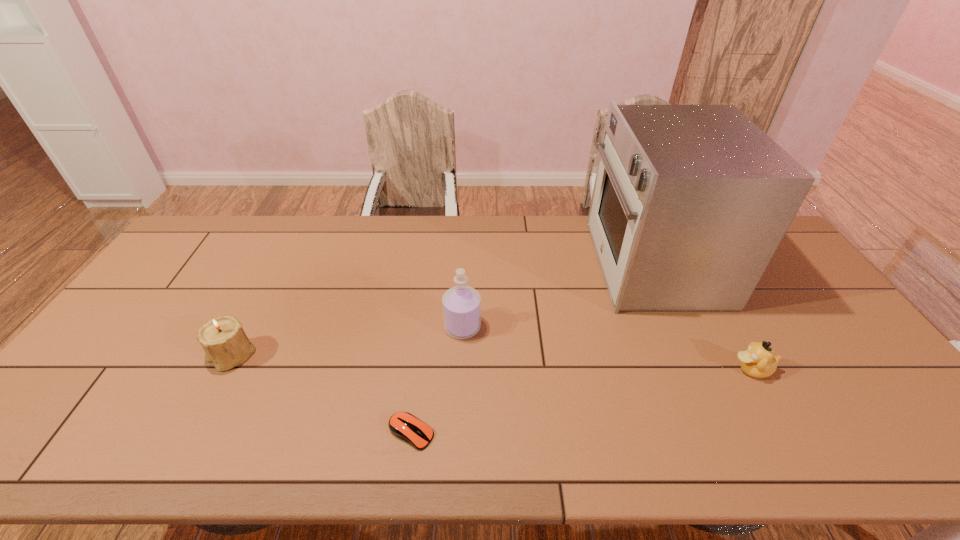
The height and width of the screenshot is (540, 960). Find the location of `toaster oven`. toaster oven is located at coordinates (690, 202).

You are a GUI agent. You are given a task and a screenshot of the screen. Output one action in this format:
    pyautogui.click(x=<x>, y=<y>)
    Task: Click on the fourth shortest object
    
    Given the screenshot: What is the action you would take?
    pyautogui.click(x=461, y=304)

At what (x,y) coordinates should I click in order to perform the action: click on the third object from left to right. Please return your answer as a coordinate pair (x, y). Looking at the image, I should click on (461, 304).

In order to click on the leftmost object in this screenshot , I will do `click(226, 345)`.

I want to click on candle_holder, so click(x=226, y=345).

This screenshot has width=960, height=540. In order to click on duckling in this screenshot , I will do `click(758, 361)`.

The image size is (960, 540). I want to click on the shortest object, so click(x=404, y=425).

I want to click on the fourth object from right to left, so click(x=404, y=425).

Where is `free point located 0.240m on the front panel of the toaster oven`? Image resolution: width=960 pixels, height=540 pixels. free point located 0.240m on the front panel of the toaster oven is located at coordinates (518, 264).

You are a GUI agent. You are given a task and a screenshot of the screen. Output one action in this format:
    pyautogui.click(x=<x>, y=<y>)
    Task: Click on the vacant space situated on the front panel of the toaster oven
    The height and width of the screenshot is (540, 960).
    Given the screenshot: What is the action you would take?
    pyautogui.click(x=564, y=264)